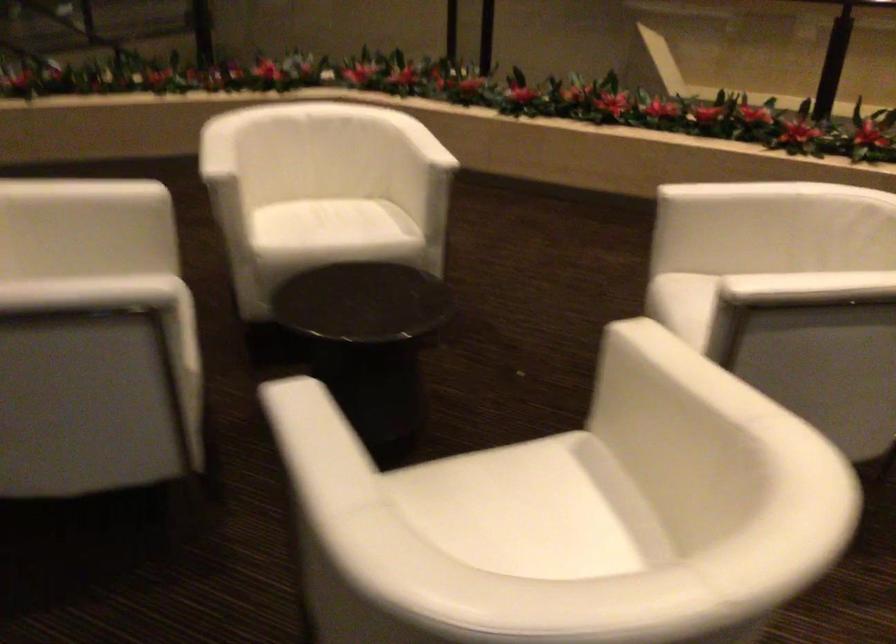
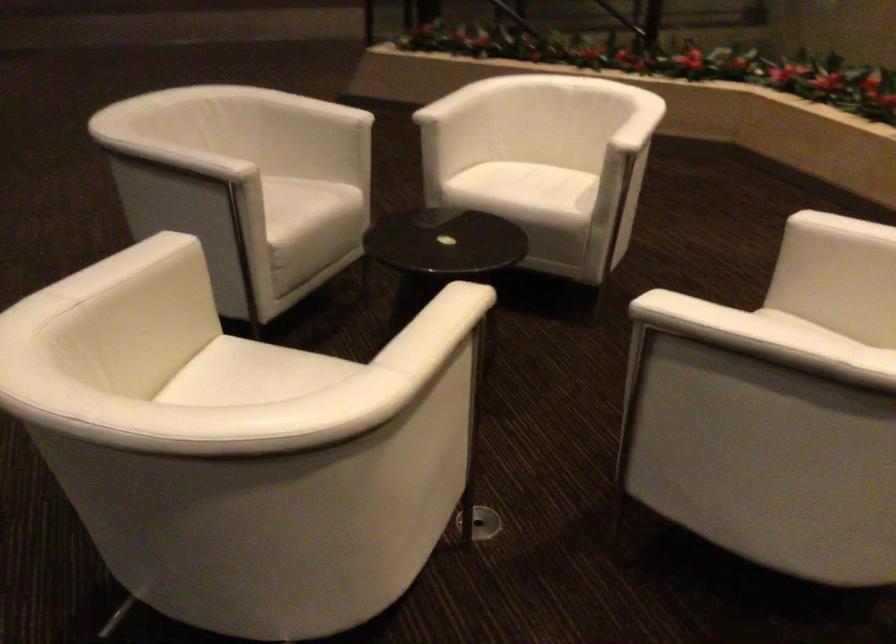
Locate, in the second image, the point that corresponds to pixel 670 355 in the first image.

(437, 308)